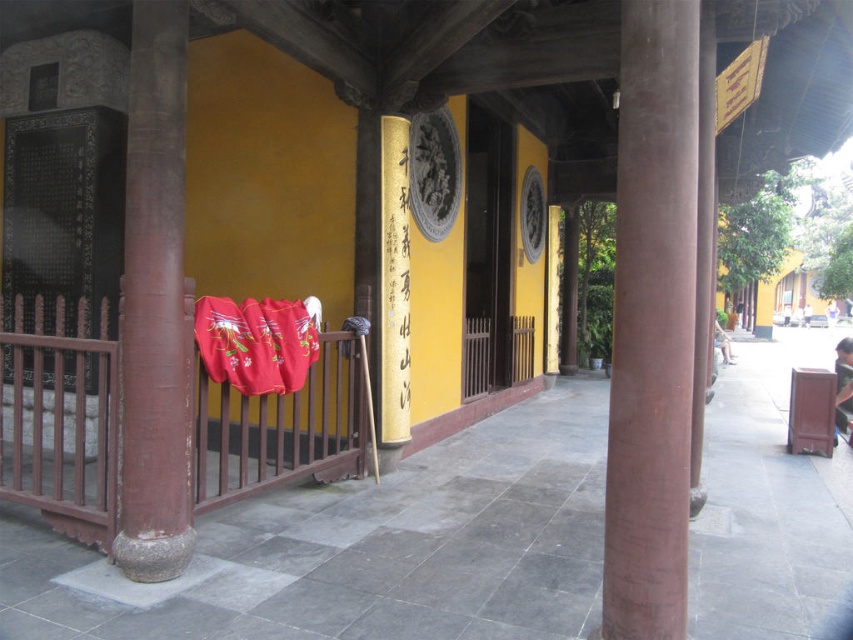
Between smooth brown pillar at center and gold paper scroll at center, which one has less height?

With less height is smooth brown pillar at center.

Locate an element on the screen. The width and height of the screenshot is (853, 640). smooth brown pillar at center is located at coordinates (653, 323).

Identify the location of smooth brown pillar at center. (653, 323).

Based on the photo, is smooth wooden rail at center left to the left of velvet red blanket at center from the viewer's perspective?

Yes, smooth wooden rail at center left is to the left of velvet red blanket at center.

Is point (53, 337) behind point (254, 378)?

No, it is in front of (254, 378).

Is point (196, 499) less distant than point (241, 387)?

Yes, point (196, 499) is in front of point (241, 387).

Where is `smooth wooden rail at center left`? Image resolution: width=853 pixels, height=640 pixels. smooth wooden rail at center left is located at coordinates (61, 419).

Does smooth wooden rail at center left appear on the left side of smooth brown pillar at left?

No, smooth wooden rail at center left is not to the left of smooth brown pillar at left.

Is point (270, 451) behind point (140, 472)?

Yes, point (270, 451) is behind point (140, 472).

This screenshot has width=853, height=640. Identify the location of smooth wooden rail at center left. (61, 419).